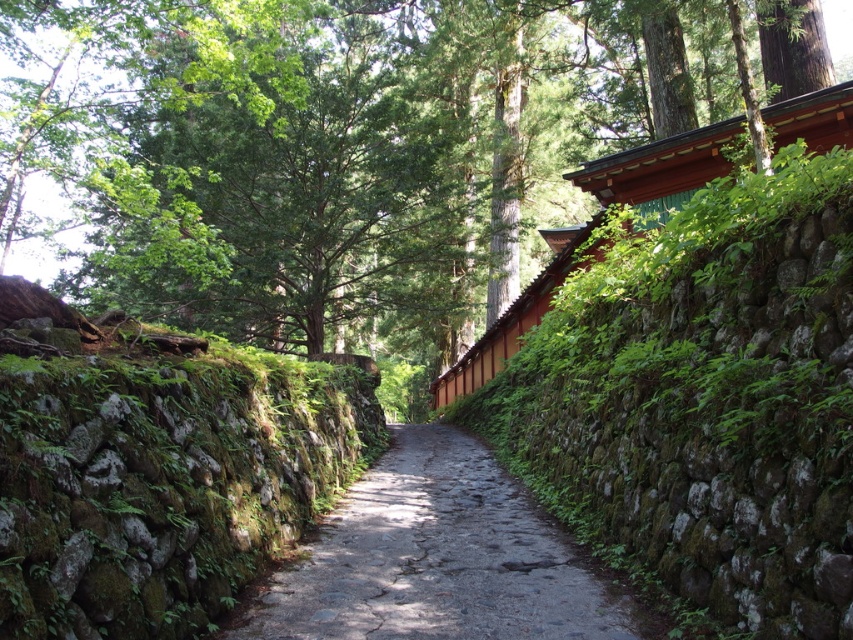
Can you confirm if green mossy stone wall at left is positioned to the right of gray stone path at center?

No, green mossy stone wall at left is not to the right of gray stone path at center.

Who is positioned more to the left, green mossy stone wall at left or gray stone path at center?

green mossy stone wall at left

Locate an element on the screen. This screenshot has width=853, height=640. green mossy stone wall at left is located at coordinates [161, 483].

Which is above, green leafy tree at upper center or green mossy stone wall at left?

Positioned higher is green leafy tree at upper center.

Is point (492, 10) more distant than point (247, 563)?

Yes, point (492, 10) is behind point (247, 563).

The height and width of the screenshot is (640, 853). What are the coordinates of `green leafy tree at upper center` in the screenshot? It's located at (312, 148).

Which is in front, point (119, 195) or point (453, 508)?

Point (453, 508)

Between point (178, 314) and point (461, 438), which one is positioned behind?

The point (461, 438) is behind.

Where is `green leafy tree at upper center`? Image resolution: width=853 pixels, height=640 pixels. green leafy tree at upper center is located at coordinates (312, 148).